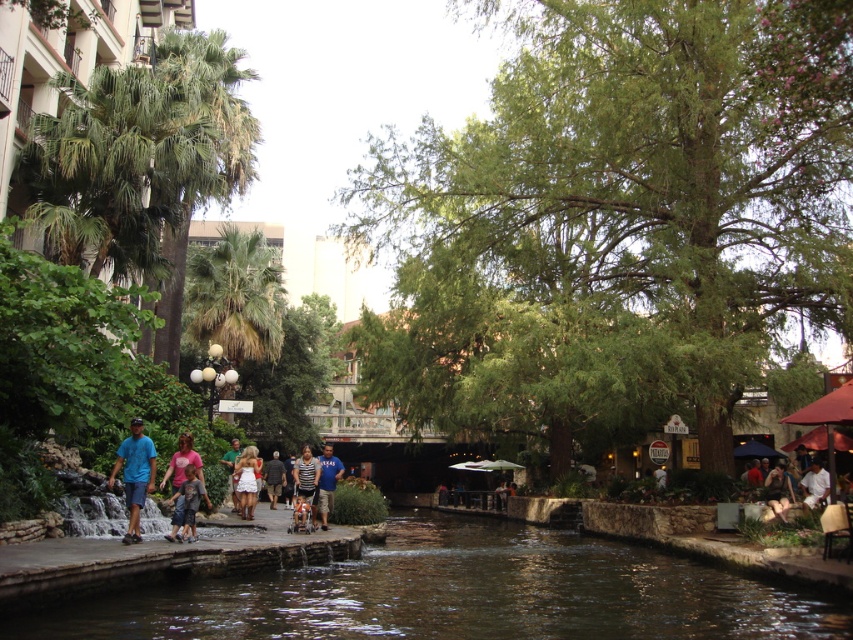
Question: Estimate the real-world distances between objects in this image. Which object is farther from the white matte dress at center?

Choices:
 (A) green fabric shirt at center
 (B) brown stone river at lower center
 (C) dark brown leather jacket at lower right
 (D) white cotton shirt at lower right

Answer: (D)

Question: Is brown stone river at lower center wider than blue denim shorts at left?

Choices:
 (A) yes
 (B) no

Answer: (A)

Question: Among these points, which one is farthest from the camera?

Choices:
 (A) coord(318,481)
 (B) coord(814,500)
 (C) coord(299,499)
 (D) coord(253,461)

Answer: (D)

Question: Observing the image, what is the correct spatial positioning of brown stone river at lower center in reference to white cotton shirt at lower right?

Choices:
 (A) below
 (B) above

Answer: (A)

Question: Can you confirm if striped fabric shirt at center is positioned below dark gray shirt at center?

Choices:
 (A) no
 (B) yes

Answer: (A)

Question: Considering the real-world distances, which object is farthest from the green fabric shirt at center?

Choices:
 (A) blue denim shorts at left
 (B) white cotton shirt at lower right
 (C) white matte dress at center

Answer: (B)